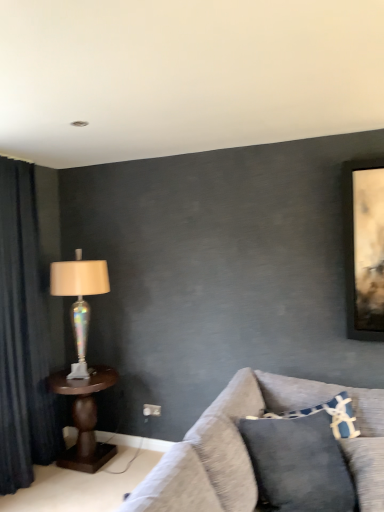
Question: Considering the relative sizes of textured gray couch at lower right and brown wooden table at left in the image provided, is textured gray couch at lower right thinner than brown wooden table at left?

Choices:
 (A) no
 (B) yes

Answer: (A)

Question: From a real-world perspective, is textured gray couch at lower right on top of brown wooden table at left?

Choices:
 (A) no
 (B) yes

Answer: (B)

Question: Is textured gray couch at lower right shorter than brown wooden table at left?

Choices:
 (A) no
 (B) yes

Answer: (B)

Question: Does textured gray couch at lower right have a smaller size compared to brown wooden table at left?

Choices:
 (A) yes
 (B) no

Answer: (B)

Question: Considering the relative sizes of textured gray couch at lower right and brown wooden table at left in the image provided, is textured gray couch at lower right taller than brown wooden table at left?

Choices:
 (A) yes
 (B) no

Answer: (B)

Question: Could you tell me if textured gray couch at lower right is turned towards brown wooden table at left?

Choices:
 (A) no
 (B) yes

Answer: (A)

Question: From a real-world perspective, does blue textured pillow at lower right stand above iridescent glass lamp at left?

Choices:
 (A) no
 (B) yes

Answer: (A)

Question: Can we say blue textured pillow at lower right lies outside iridescent glass lamp at left?

Choices:
 (A) yes
 (B) no

Answer: (A)

Question: From the image's perspective, would you say blue textured pillow at lower right is positioned over iridescent glass lamp at left?

Choices:
 (A) no
 (B) yes

Answer: (A)

Question: Does blue textured pillow at lower right have a greater width compared to iridescent glass lamp at left?

Choices:
 (A) no
 (B) yes

Answer: (A)

Question: Does blue textured pillow at lower right appear on the left side of iridescent glass lamp at left?

Choices:
 (A) yes
 (B) no

Answer: (B)

Question: Is iridescent glass lamp at left located within blue textured pillow at lower right?

Choices:
 (A) no
 (B) yes

Answer: (A)

Question: From the image's perspective, would you say dark blue fabric curtain at left is shown under iridescent glass lamp at left?

Choices:
 (A) no
 (B) yes

Answer: (B)